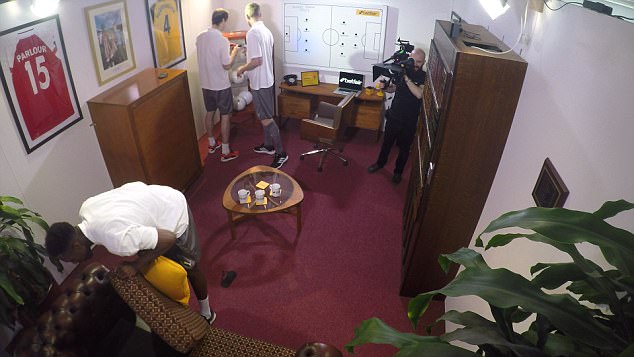
I want to click on dresser, so click(x=155, y=129).